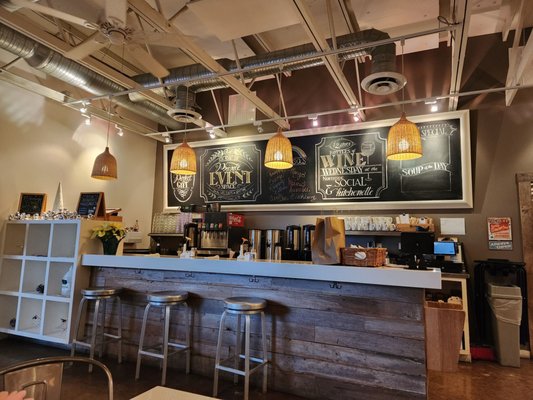
The image size is (533, 400). In order to click on coffee pots in this screenshot , I will do `click(294, 240)`, `click(306, 239)`, `click(279, 241)`, `click(256, 236)`.